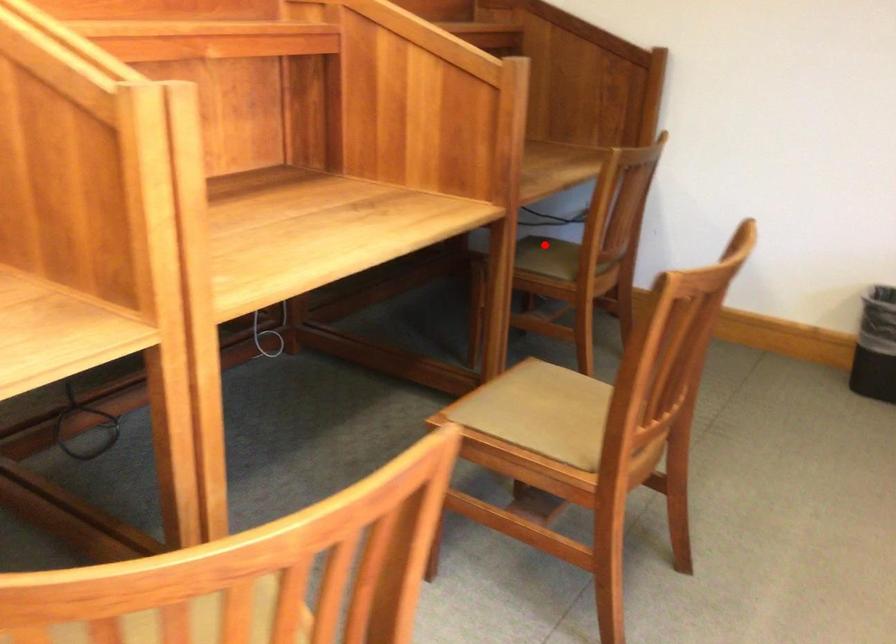
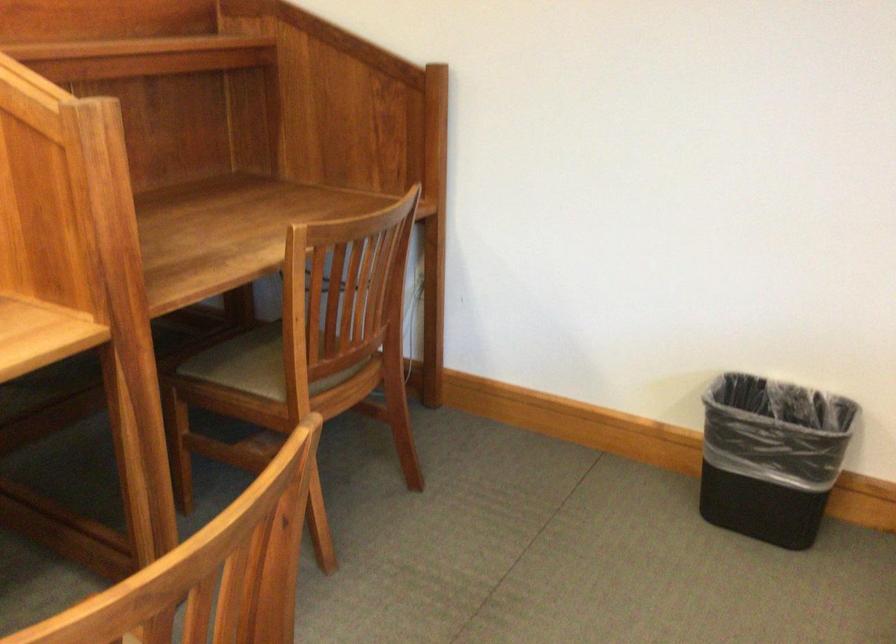
The point at the highlighted location is marked in the first image. Where is the corresponding point in the second image?

(254, 351)